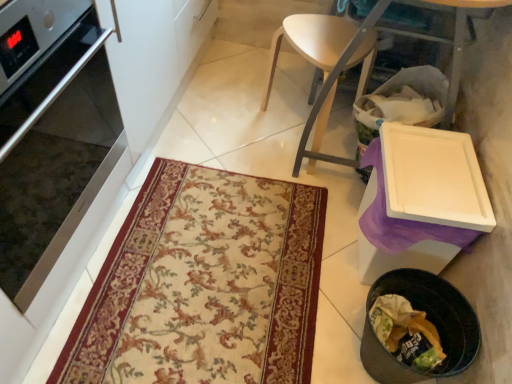
What are the coordinates of `vacant region to the left of light wood chair at center` in the screenshot? It's located at (215, 119).